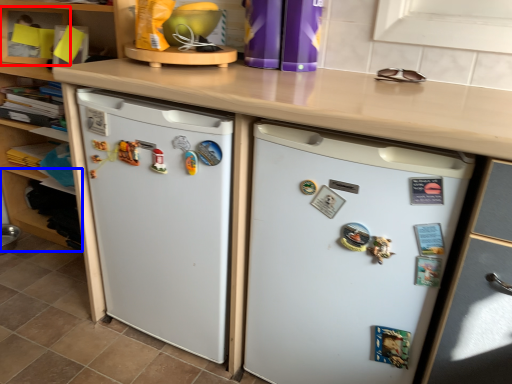
Question: Which point is further to the camera, shelf (highlighted by a red box) or shelf (highlighted by a blue box)?

Choices:
 (A) shelf
 (B) shelf

Answer: (A)